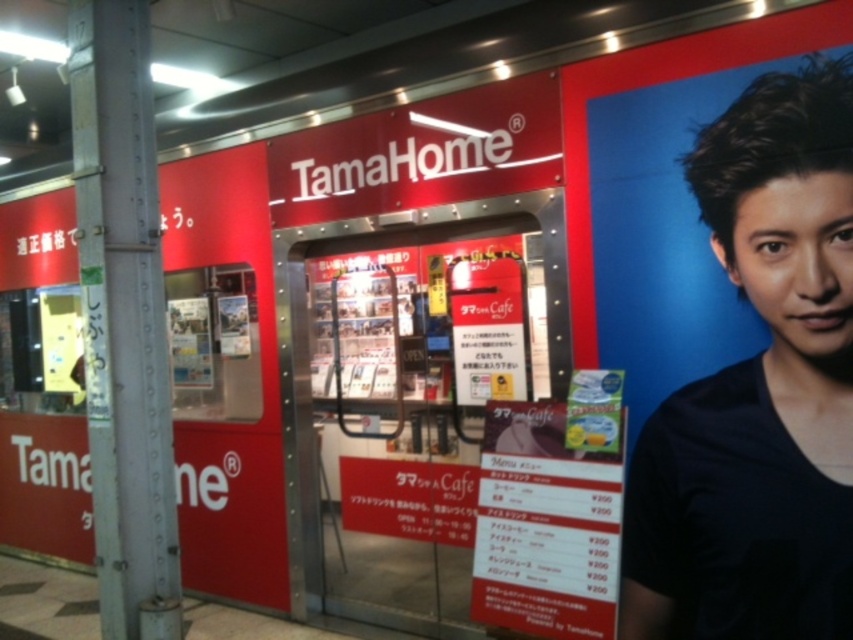
You are standing in front of the TamaHome storefront and notice two objects in the scene. One is the black matte shirt at right and the other is the metallic gray pole at left. Which object is positioned farther to the right side of the image?

The black matte shirt at right is positioned farther to the right side of the image than the metallic gray pole at left.

You are standing in front of the TamaHome storefront and want to locate two specific points marked on the image. The first point is at coordinates point (x=700, y=513) and the second is at point (x=131, y=525). Which of these two points is closer to you?

Point (x=700, y=513) is in front of point (x=131, y=525), so the first point is closer to you.

You are standing in front of the TamaHome storefront and notice a person to your right. Where exactly is the black matte shirt at right positioned in the image?

The black matte shirt at right is located at point 0.609 on the x axis and 0.891 on the y axis.